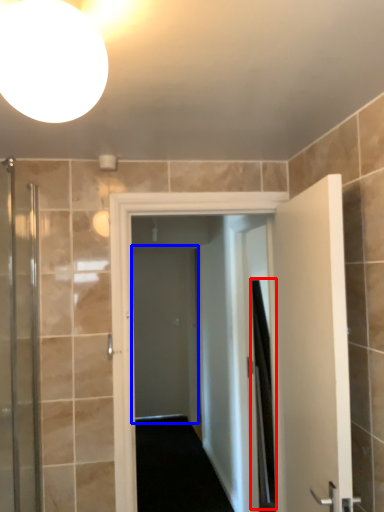
Question: Which of the following is the farthest to the observer, shower curtain (highlighted by a red box) or screen door (highlighted by a blue box)?

Choices:
 (A) shower curtain
 (B) screen door

Answer: (B)